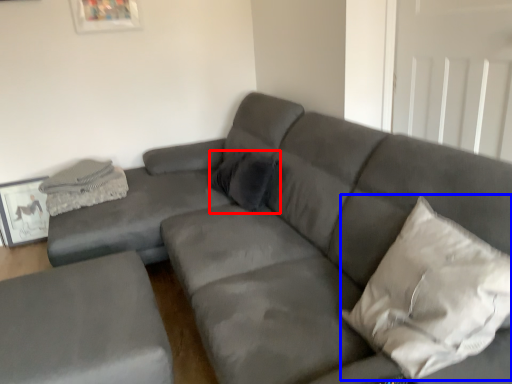
Question: Which object is further to the camera taking this photo, pillow (highlighted by a red box) or pillow (highlighted by a blue box)?

Choices:
 (A) pillow
 (B) pillow

Answer: (A)